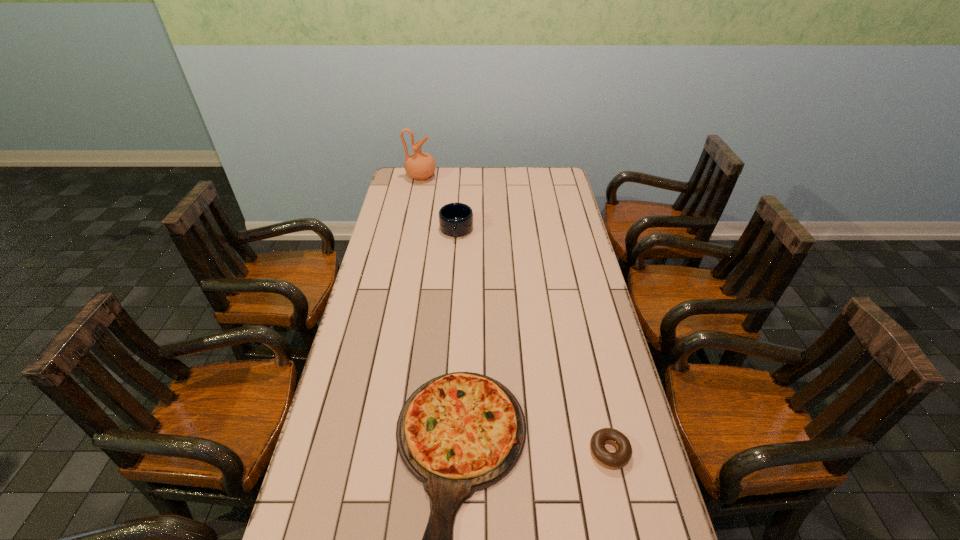
Identify the location of object that is at the left edge. The image size is (960, 540). (420, 165).

Locate an element on the screen. This screenshot has height=540, width=960. object located in the right edge section of the desktop is located at coordinates (618, 459).

Where is `object located in the far left corner section of the desktop`? This screenshot has width=960, height=540. object located in the far left corner section of the desktop is located at coordinates (420, 165).

You are a GUI agent. You are given a task and a screenshot of the screen. Output one action in this format:
    pyautogui.click(x=<x>, y=<y>)
    Task: Click on the vacant space at the far edge of the desktop
    The height and width of the screenshot is (540, 960).
    Given the screenshot: What is the action you would take?
    click(527, 191)

This screenshot has height=540, width=960. In the image, there is a desktop. What are the coordinates of `free region at the left edge` in the screenshot? It's located at (402, 192).

The image size is (960, 540). In order to click on free region at the right edge in this screenshot , I will do `click(572, 230)`.

This screenshot has width=960, height=540. In the image, there is a desktop. In order to click on free space at the far right corner in this screenshot , I will do `click(554, 191)`.

Identify the location of free area in between the doughnut and the farthest object. This screenshot has width=960, height=540. (516, 314).

Where is `empty location between the mug and the shortest object`? empty location between the mug and the shortest object is located at coordinates (533, 341).

The height and width of the screenshot is (540, 960). Find the location of `unoccupied position between the third nearest object and the shortest object`. unoccupied position between the third nearest object and the shortest object is located at coordinates (533, 341).